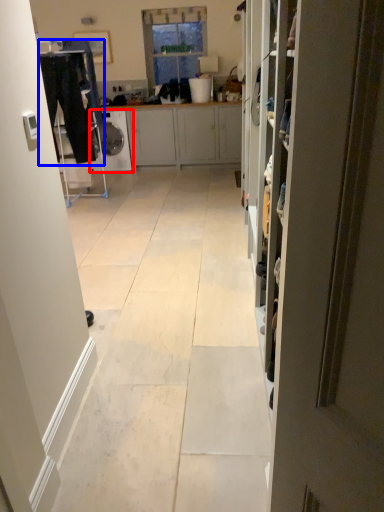
Question: Which object is closer to the camera taking this photo, dish washer (highlighted by a red box) or laundry (highlighted by a blue box)?

Choices:
 (A) dish washer
 (B) laundry

Answer: (B)